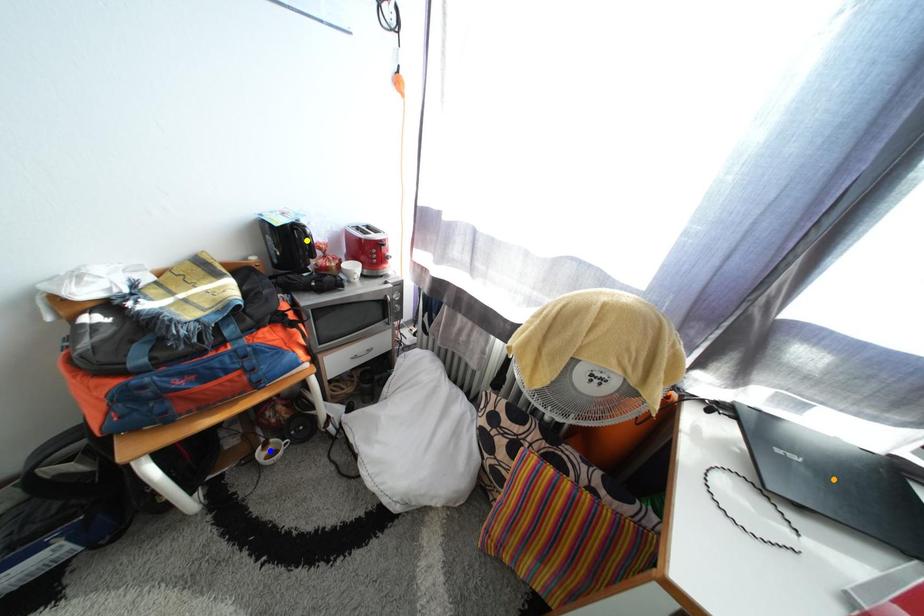
From the picture: Order these from nearest to farthest:
1. blue point
2. yellow point
3. orange point

blue point < yellow point < orange point